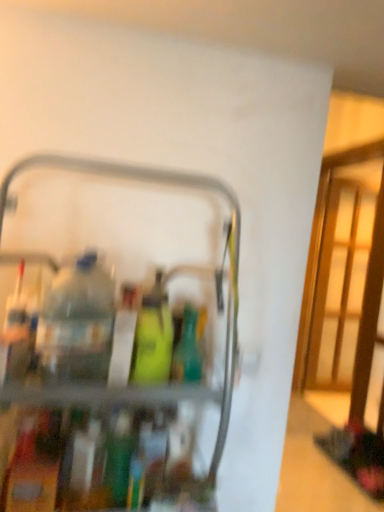
What do you see at coordinates (187, 350) in the screenshot? The image size is (384, 512). I see `green matte bottle at center, placed as the 2th bottle when sorted from top to bottom` at bounding box center [187, 350].

What do you see at coordinates (153, 337) in the screenshot? The width and height of the screenshot is (384, 512). I see `green matte bottle at center, arranged as the third bottle when ordered from the bottom` at bounding box center [153, 337].

You are a GUI agent. You are given a task and a screenshot of the screen. Output one action in this format:
    pyautogui.click(x=<x>, y=<y>)
    Task: Click on the green matte bottle at center, which is the 1th bottle in top-to-bottom order
    Image resolution: width=384 pixels, height=512 pixels.
    Given the screenshot: What is the action you would take?
    click(153, 337)

The height and width of the screenshot is (512, 384). Find the location of `metallic gray cart at center`. metallic gray cart at center is located at coordinates (228, 238).

What are the coordinates of `green matte bottle at center, which ranks as the 3th bottle in top-to-bottom order` in the screenshot? It's located at (119, 458).

Identify the location of green matte bottle at center, placed as the 2th bottle when sorted from top to bottom. (187, 350).

Between point (193, 319) and point (216, 441), which one is positioned in front?

Point (193, 319)

Based on their positions, is green matte bottle at center, positioned as the 2th bottle in bottom-to-top order, located to the left or right of metallic gray cart at center?

From the image, it's evident that green matte bottle at center, positioned as the 2th bottle in bottom-to-top order, is to the right of metallic gray cart at center.

Relative to metallic gray cart at center, is green matte bottle at center, positioned as the 2th bottle in bottom-to-top order, in front or behind?

green matte bottle at center, positioned as the 2th bottle in bottom-to-top order, is behind metallic gray cart at center.

What's the angular difference between green matte bottle at center, arranged as the third bottle when ordered from the bottom, and green matte bottle at center, arranged as the 1th bottle when ordered from the bottom,'s facing directions?

There is a 0.766-degree angle between the facing directions of green matte bottle at center, arranged as the third bottle when ordered from the bottom, and green matte bottle at center, arranged as the 1th bottle when ordered from the bottom.

Who is taller, green matte bottle at center, which is the 1th bottle in top-to-bottom order, or green matte bottle at center, arranged as the 1th bottle when ordered from the bottom?

With more height is green matte bottle at center, which is the 1th bottle in top-to-bottom order.

In the scene shown: From a real-world perspective, who is located higher, green matte bottle at center, arranged as the third bottle when ordered from the bottom, or green matte bottle at center, arranged as the 1th bottle when ordered from the bottom?

green matte bottle at center, arranged as the third bottle when ordered from the bottom, is physically above.

From the image's perspective, is metallic gray cart at center below green matte bottle at center, positioned as the 2th bottle in bottom-to-top order?

Yes, from the image's perspective, metallic gray cart at center is beneath green matte bottle at center, positioned as the 2th bottle in bottom-to-top order.

Is point (85, 169) closer to camera compared to point (182, 380)?

No, it is behind (182, 380).

Considering their positions, is metallic gray cart at center located in front of or behind green matte bottle at center, positioned as the 2th bottle in bottom-to-top order?

metallic gray cart at center is in front of green matte bottle at center, positioned as the 2th bottle in bottom-to-top order.

Which of these two, metallic gray cart at center or green matte bottle at center, positioned as the 2th bottle in bottom-to-top order, is wider?

With larger width is metallic gray cart at center.

Considering the sizes of objects green matte bottle at center, which ranks as the 3th bottle in top-to-bottom order, and metallic gray cart at center in the image provided, who is shorter, green matte bottle at center, which ranks as the 3th bottle in top-to-bottom order, or metallic gray cart at center?

Standing shorter between the two is green matte bottle at center, which ranks as the 3th bottle in top-to-bottom order.

From the image's perspective, who appears lower, green matte bottle at center, arranged as the 1th bottle when ordered from the bottom, or metallic gray cart at center?

green matte bottle at center, arranged as the 1th bottle when ordered from the bottom, from the image's perspective.

Is green matte bottle at center, arranged as the 1th bottle when ordered from the bottom, turned away from metallic gray cart at center?

Yes, green matte bottle at center, arranged as the 1th bottle when ordered from the bottom,'s orientation is away from metallic gray cart at center.

Which object is further away from the camera, metallic gray cart at center or green matte bottle at center, which is the 1th bottle in top-to-bottom order?

green matte bottle at center, which is the 1th bottle in top-to-bottom order, is further away from the camera.

Is there a large distance between metallic gray cart at center and green matte bottle at center, which is the 1th bottle in top-to-bottom order?

metallic gray cart at center is near green matte bottle at center, which is the 1th bottle in top-to-bottom order, not far away.

Consider the image. From a real-world perspective, is metallic gray cart at center positioned above or below green matte bottle at center, arranged as the third bottle when ordered from the bottom?

In terms of real-world spatial position, metallic gray cart at center is below green matte bottle at center, arranged as the third bottle when ordered from the bottom.

Does metallic gray cart at center turn towards green matte bottle at center, arranged as the third bottle when ordered from the bottom?

Yes, metallic gray cart at center is aimed at green matte bottle at center, arranged as the third bottle when ordered from the bottom.

From the image's perspective, which object appears higher, green matte bottle at center, positioned as the 2th bottle in bottom-to-top order, or green matte bottle at center, which ranks as the 3th bottle in top-to-bottom order?

green matte bottle at center, positioned as the 2th bottle in bottom-to-top order, from the image's perspective.

Which of these two, green matte bottle at center, placed as the 2th bottle when sorted from top to bottom, or green matte bottle at center, which ranks as the 3th bottle in top-to-bottom order, is wider?

green matte bottle at center, placed as the 2th bottle when sorted from top to bottom.

Does green matte bottle at center, positioned as the 2th bottle in bottom-to-top order, come behind green matte bottle at center, arranged as the 1th bottle when ordered from the bottom?

Yes, it is.

Can you confirm if green matte bottle at center, positioned as the 2th bottle in bottom-to-top order, is positioned to the right of green matte bottle at center, arranged as the 1th bottle when ordered from the bottom?

Correct, you'll find green matte bottle at center, positioned as the 2th bottle in bottom-to-top order, to the right of green matte bottle at center, arranged as the 1th bottle when ordered from the bottom.

Would you consider green matte bottle at center, positioned as the 2th bottle in bottom-to-top order, to be distant from green matte bottle at center, which is the 1th bottle in top-to-bottom order?

Actually, green matte bottle at center, positioned as the 2th bottle in bottom-to-top order, and green matte bottle at center, which is the 1th bottle in top-to-bottom order, are a little close together.

Does point (180, 334) appear closer or farther from the camera than point (152, 315)?

Point (180, 334) is positioned farther from the camera compared to point (152, 315).

From the image's perspective, does green matte bottle at center, positioned as the 2th bottle in bottom-to-top order, appear lower than green matte bottle at center, arranged as the third bottle when ordered from the bottom?

Correct, green matte bottle at center, positioned as the 2th bottle in bottom-to-top order, appears lower than green matte bottle at center, arranged as the third bottle when ordered from the bottom, in the image.

Is green matte bottle at center, positioned as the 2th bottle in bottom-to-top order, in front of or behind green matte bottle at center, which is the 1th bottle in top-to-bottom order, in the image?

In the image, green matte bottle at center, positioned as the 2th bottle in bottom-to-top order, appears behind green matte bottle at center, which is the 1th bottle in top-to-bottom order.

In the image, there is a green matte bottle at center, placed as the 2th bottle when sorted from top to bottom. Find the location of `appliance below it (from a real-world perspective)`. appliance below it (from a real-world perspective) is located at coordinates (228, 238).

From the image's perspective, starting from the green matte bottle at center, which ranks as the 3th bottle in top-to-bottom order, which bottle is the 2nd one above? Please provide its 2D coordinates.

[(153, 337)]

Based on the photo, based on their spatial positions, is green matte bottle at center, positioned as the 2th bottle in bottom-to-top order, or metallic gray cart at center further from green matte bottle at center, arranged as the 1th bottle when ordered from the bottom?

metallic gray cart at center lies further to green matte bottle at center, arranged as the 1th bottle when ordered from the bottom, than the other object.

Which object lies further to the anchor point green matte bottle at center, arranged as the third bottle when ordered from the bottom, metallic gray cart at center or green matte bottle at center, which ranks as the 3th bottle in top-to-bottom order?

The object further to green matte bottle at center, arranged as the third bottle when ordered from the bottom, is metallic gray cart at center.

Based on their spatial positions, is green matte bottle at center, placed as the 2th bottle when sorted from top to bottom, or green matte bottle at center, which is the 1th bottle in top-to-bottom order, further from green matte bottle at center, which ranks as the 3th bottle in top-to-bottom order?

The object further to green matte bottle at center, which ranks as the 3th bottle in top-to-bottom order, is green matte bottle at center, placed as the 2th bottle when sorted from top to bottom.

Estimate the real-world distances between objects in this image. Which object is closer to green matte bottle at center, arranged as the third bottle when ordered from the bottom, green matte bottle at center, arranged as the 1th bottle when ordered from the bottom, or green matte bottle at center, positioned as the 2th bottle in bottom-to-top order?

green matte bottle at center, positioned as the 2th bottle in bottom-to-top order.

From the image, which object appears to be farther from metallic gray cart at center, green matte bottle at center, positioned as the 2th bottle in bottom-to-top order, or green matte bottle at center, arranged as the third bottle when ordered from the bottom?

Among the two, green matte bottle at center, arranged as the third bottle when ordered from the bottom, is located further to metallic gray cart at center.

Looking at the image, which one is located closer to green matte bottle at center, arranged as the 1th bottle when ordered from the bottom, green matte bottle at center, arranged as the third bottle when ordered from the bottom, or metallic gray cart at center?

green matte bottle at center, arranged as the third bottle when ordered from the bottom, is closer to green matte bottle at center, arranged as the 1th bottle when ordered from the bottom.

Based on the photo, from the image, which object appears to be farther from green matte bottle at center, arranged as the 1th bottle when ordered from the bottom, metallic gray cart at center or green matte bottle at center, arranged as the third bottle when ordered from the bottom?

metallic gray cart at center is further to green matte bottle at center, arranged as the 1th bottle when ordered from the bottom.

Considering their positions, is metallic gray cart at center positioned further to green matte bottle at center, positioned as the 2th bottle in bottom-to-top order, than green matte bottle at center, arranged as the third bottle when ordered from the bottom?

Based on the image, metallic gray cart at center appears to be further to green matte bottle at center, positioned as the 2th bottle in bottom-to-top order.

Locate an element on the screen. Image resolution: width=384 pixels, height=512 pixels. appliance between green matte bottle at center, arranged as the third bottle when ordered from the bottom, and green matte bottle at center, arranged as the 1th bottle when ordered from the bottom, from top to bottom is located at coordinates (228, 238).

The image size is (384, 512). Identify the location of bottle between green matte bottle at center, arranged as the third bottle when ordered from the bottom, and green matte bottle at center, which ranks as the 3th bottle in top-to-bottom order, in the vertical direction. (187, 350).